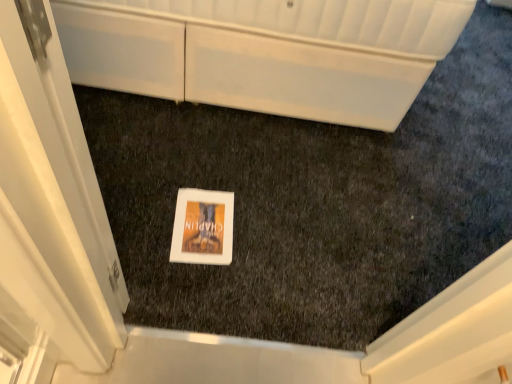
The image size is (512, 384). What are the coordinates of `unoccupied region to the right of white glossy door at center` in the screenshot? It's located at (167, 302).